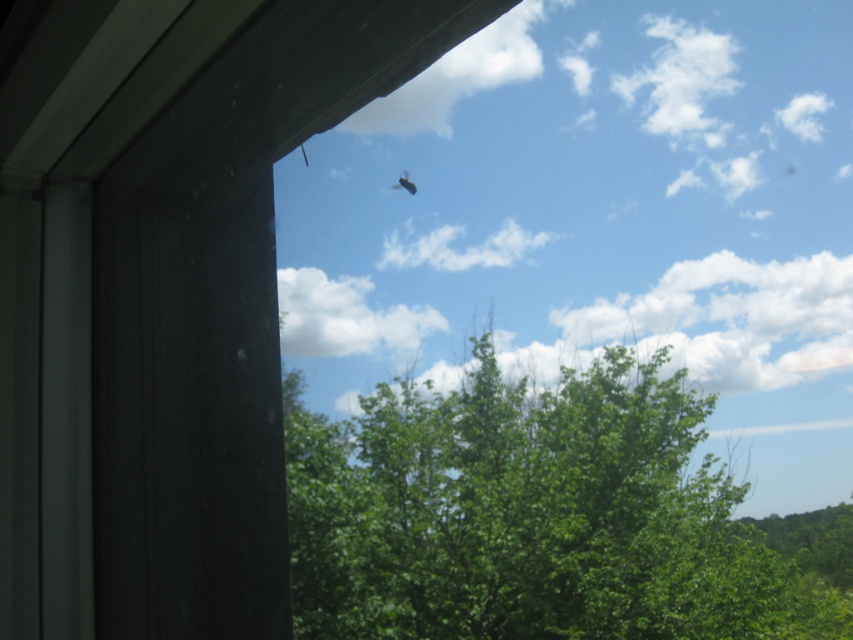
Question: In this image, where is green leafy tree at center located relative to black matte bird at upper center?

Choices:
 (A) below
 (B) above

Answer: (A)

Question: Which object appears closest to the camera in this image?

Choices:
 (A) green leafy tree at center
 (B) black matte bird at upper center

Answer: (A)

Question: Is green leafy tree at center bigger than black matte bird at upper center?

Choices:
 (A) no
 (B) yes

Answer: (B)

Question: Which object appears closest to the camera in this image?

Choices:
 (A) green leafy tree at center
 (B) black matte bird at upper center

Answer: (A)

Question: Can you confirm if green leafy tree at center is wider than black matte bird at upper center?

Choices:
 (A) yes
 (B) no

Answer: (A)

Question: Which object is farther from the camera taking this photo?

Choices:
 (A) black matte bird at upper center
 (B) green leafy tree at center

Answer: (A)